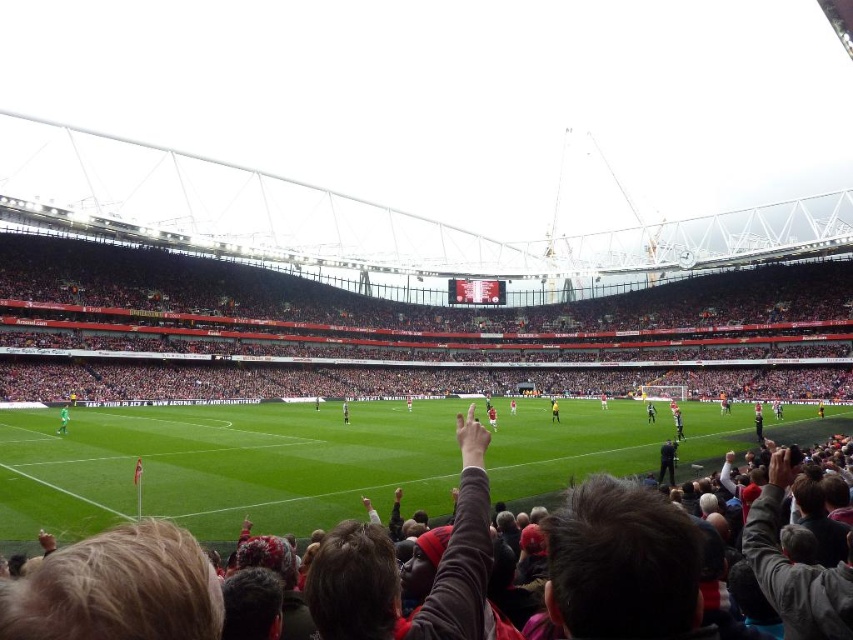
Question: Among these objects, which one is nearest to the camera?

Choices:
 (A) yellow jersey at center
 (B) green grass football field at center

Answer: (B)

Question: Does green grass football field at center have a smaller size compared to green jersey at center?

Choices:
 (A) no
 (B) yes

Answer: (A)

Question: Which of the following is the farthest from the observer?

Choices:
 (A) green grass football field at center
 (B) yellow jersey at center

Answer: (B)

Question: Is green jersey at center wider than yellow jersey at center?

Choices:
 (A) no
 (B) yes

Answer: (B)

Question: Is green grass football field at center to the left of yellow jersey at center from the viewer's perspective?

Choices:
 (A) yes
 (B) no

Answer: (A)

Question: Considering the real-world distances, which object is farthest from the green jersey at center?

Choices:
 (A) green grass football field at center
 (B) yellow jersey at center

Answer: (B)